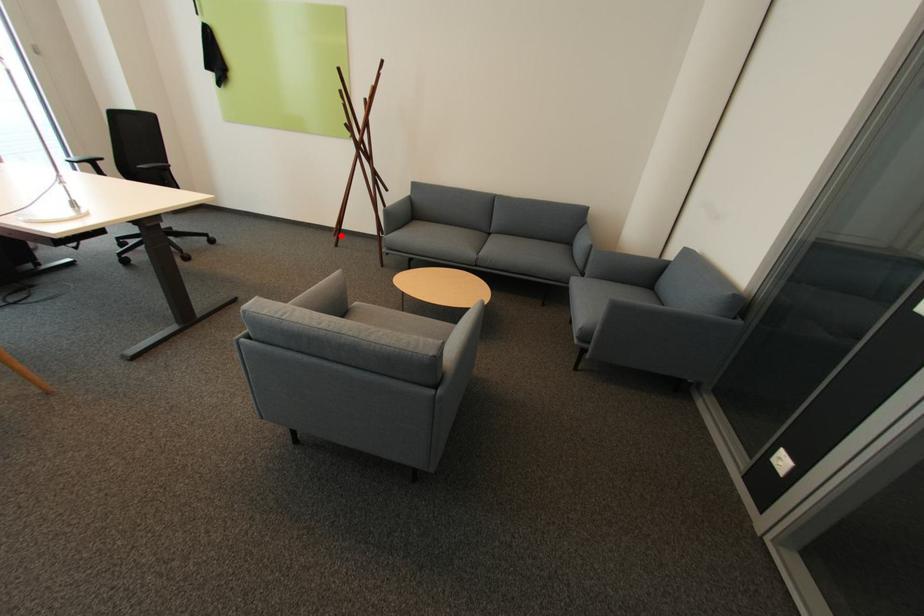
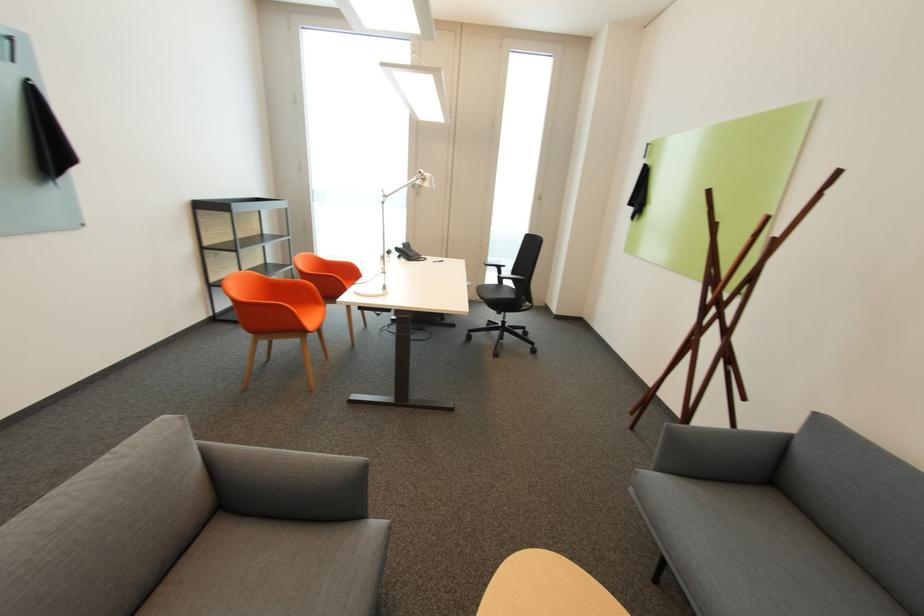
Question: I am providing you with two images of the same scene from different viewpoints. Image1 has a red point marked. In image2, the corresponding 3D location appears at what relative position? Reply with the corresponding letter.

Choices:
 (A) Closer
 (B) Farther

Answer: (B)